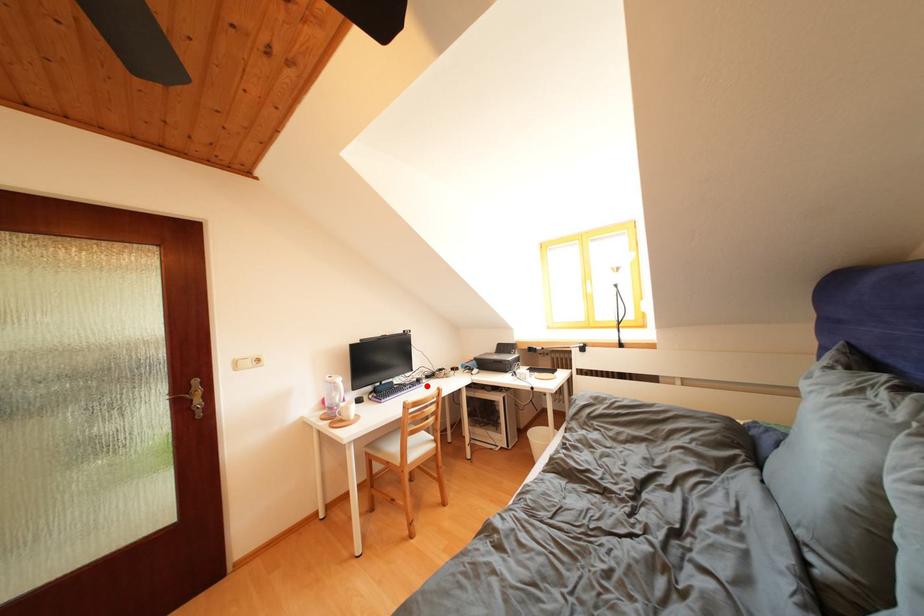
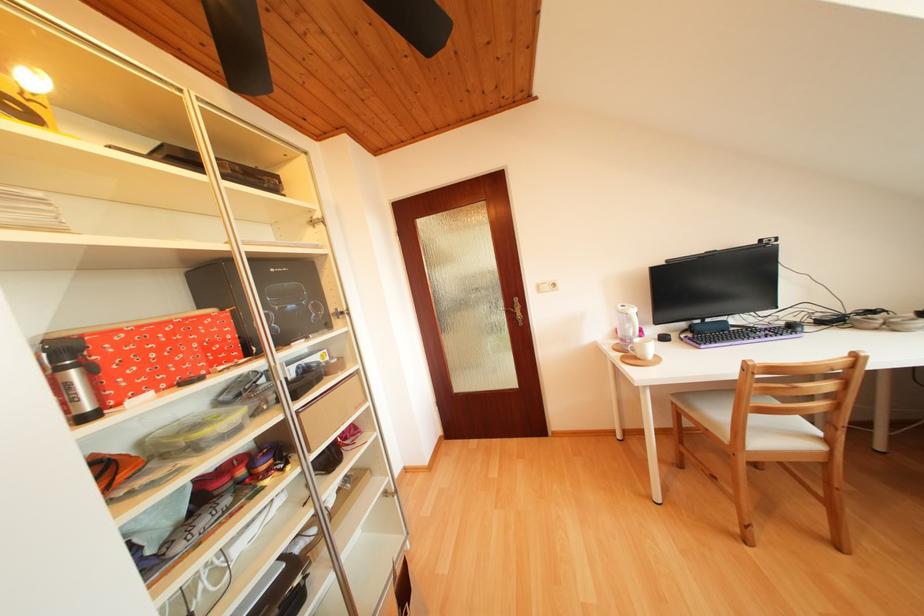
Question: I am providing you with two images of the same scene from different viewpoints. Image1 has a red point marked. In image2, the corresponding 3D location appears at what relative position? Reply with the corresponding letter.

Choices:
 (A) Closer
 (B) Farther

Answer: (A)